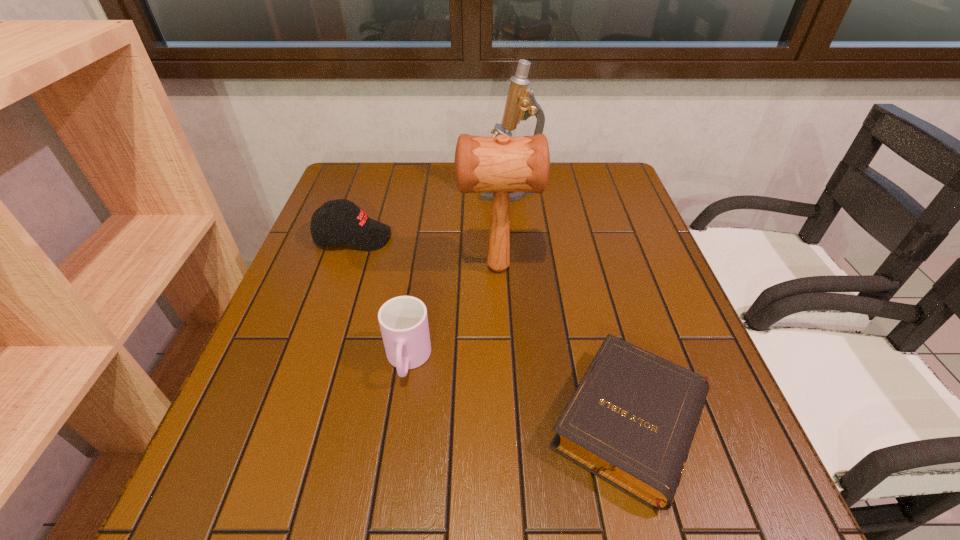
Where is `the farthest object`? This screenshot has width=960, height=540. the farthest object is located at coordinates (521, 104).

Locate an element on the screen. This screenshot has width=960, height=540. mallet is located at coordinates (502, 164).

Where is `cup`? cup is located at coordinates (403, 320).

At what (x,y) coordinates should I click in order to perform the action: click on the leftmost object. Please return your answer as a coordinate pair (x, y). The height and width of the screenshot is (540, 960). Looking at the image, I should click on point(338,221).

Locate an element on the screen. The height and width of the screenshot is (540, 960). the shortest object is located at coordinates (631, 421).

Image resolution: width=960 pixels, height=540 pixels. Find the location of `vacant space located 0.140m on the left of the farthest object`. vacant space located 0.140m on the left of the farthest object is located at coordinates (x=435, y=190).

At what (x,y) coordinates should I click in order to perform the action: click on blank area located 0.260m on the strike surface of the mallet. Please return your answer as a coordinate pair (x, y). Looking at the image, I should click on click(353, 267).

Find the location of a particular element. The image size is (960, 540). vacant space positioned on the strike surface of the mallet is located at coordinates (365, 267).

The height and width of the screenshot is (540, 960). I want to click on vacant space located 0.270m on the strike surface of the mallet, so click(348, 267).

You are a GUI agent. You are given a task and a screenshot of the screen. Output one action in this format:
    pyautogui.click(x=<x>, y=<y>)
    Task: Click on the free space located 0.170m with the handle on the side of the fourth object from right to left
    The width and height of the screenshot is (960, 540).
    Given the screenshot: What is the action you would take?
    pyautogui.click(x=390, y=482)